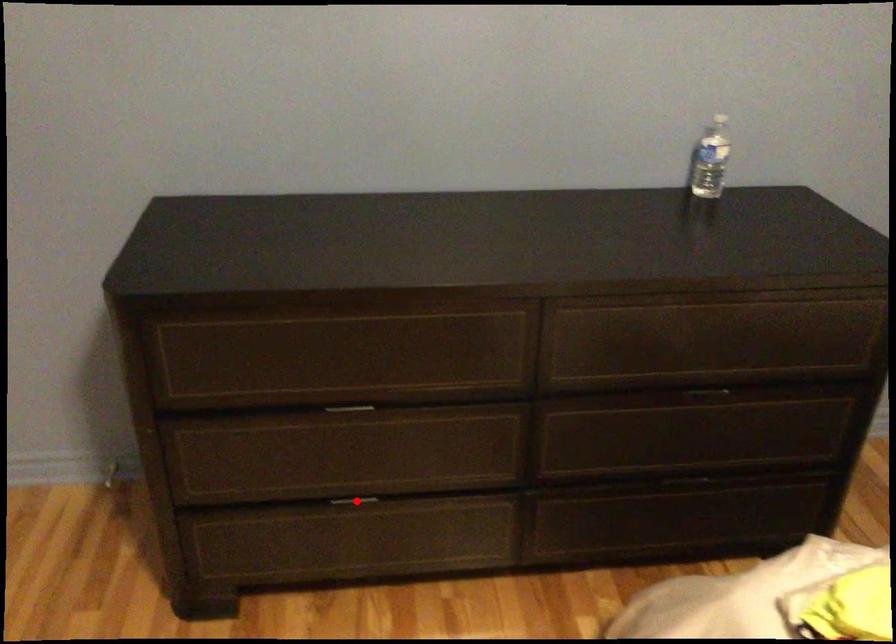
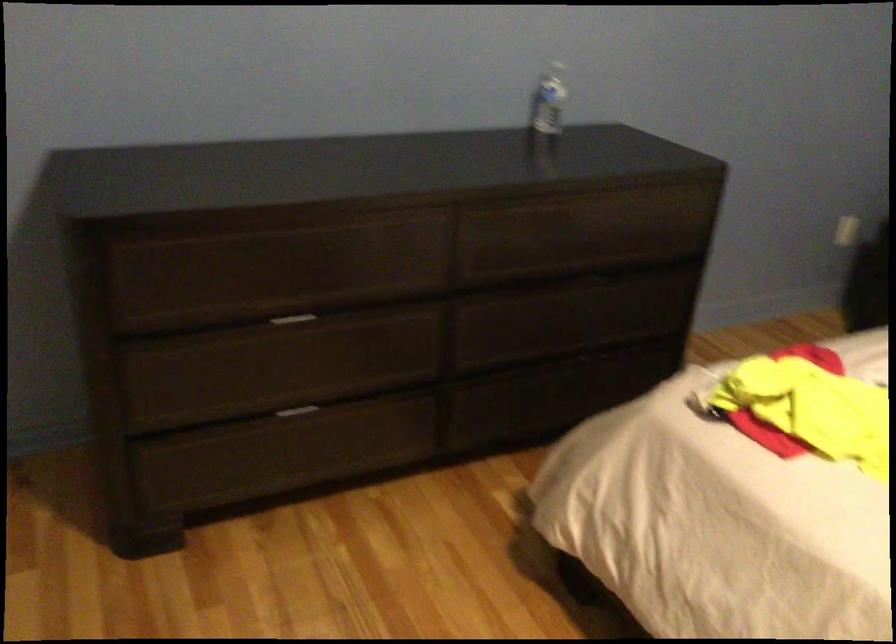
Find the pixel in the second image that matches the highlighted location in the first image.

(297, 411)